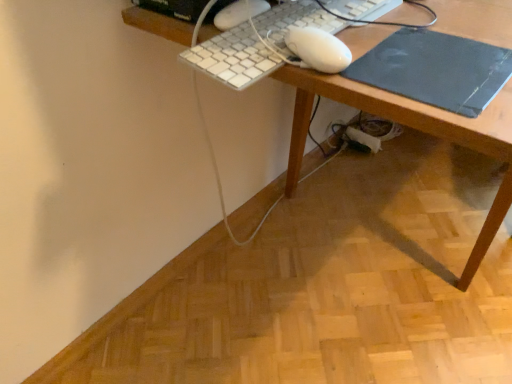
Question: Should I look upward or downward to see black matte mousepad at right?

Choices:
 (A) down
 (B) up

Answer: (B)

Question: Can we say black matte mousepad at right lies outside wooden desk at center?

Choices:
 (A) yes
 (B) no

Answer: (B)

Question: Is black matte mousepad at right facing away from wooden desk at center?

Choices:
 (A) yes
 (B) no

Answer: (B)

Question: Is there a large distance between black matte mousepad at right and wooden desk at center?

Choices:
 (A) no
 (B) yes

Answer: (A)

Question: From the image's perspective, is black matte mousepad at right on wooden desk at center?

Choices:
 (A) yes
 (B) no

Answer: (B)

Question: Is black matte mousepad at right closer to camera compared to wooden desk at center?

Choices:
 (A) yes
 (B) no

Answer: (B)

Question: Would you say black matte mousepad at right contains wooden desk at center?

Choices:
 (A) yes
 (B) no

Answer: (B)

Question: Is white plastic keyboard at upper center turned away from black matte mousepad at right?

Choices:
 (A) yes
 (B) no

Answer: (B)

Question: Does white plastic keyboard at upper center have a smaller size compared to black matte mousepad at right?

Choices:
 (A) yes
 (B) no

Answer: (B)

Question: From a real-world perspective, is white plastic keyboard at upper center over black matte mousepad at right?

Choices:
 (A) no
 (B) yes

Answer: (B)

Question: From a real-world perspective, is white plastic keyboard at upper center located beneath black matte mousepad at right?

Choices:
 (A) yes
 (B) no

Answer: (B)

Question: Is white plastic keyboard at upper center not inside black matte mousepad at right?

Choices:
 (A) no
 (B) yes

Answer: (B)

Question: Can you confirm if white plastic keyboard at upper center is shorter than black matte mousepad at right?

Choices:
 (A) yes
 (B) no

Answer: (B)

Question: Is white plastic keyboard at upper center taller than wooden desk at center?

Choices:
 (A) yes
 (B) no

Answer: (B)